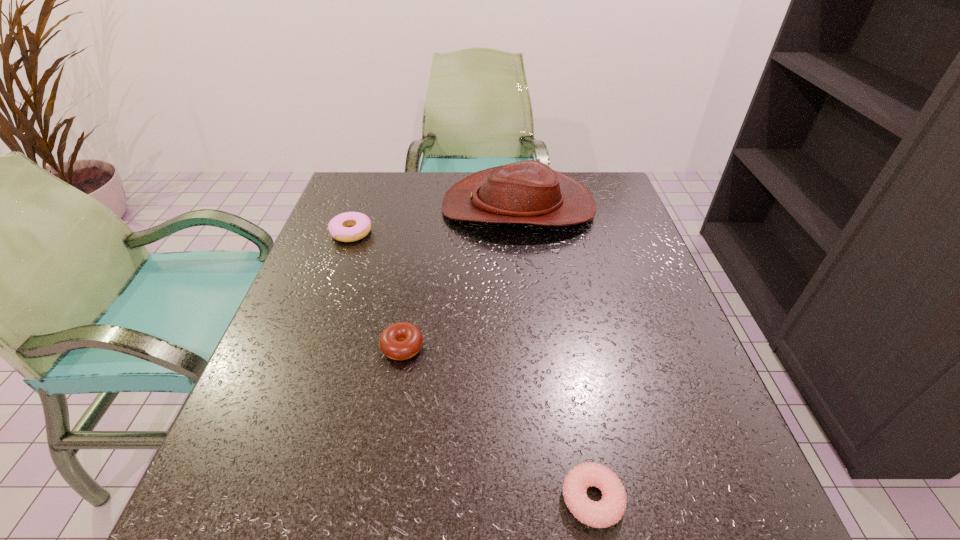
Find the location of a particular element. The height and width of the screenshot is (540, 960). free point between the second nearest doughnut and the leftmost doughnut is located at coordinates click(x=377, y=289).

Where is `vacant area that lies between the tallest object and the second nearest doughnut`? vacant area that lies between the tallest object and the second nearest doughnut is located at coordinates (460, 277).

I want to click on vacant area that lies between the nearest doughnut and the leftmost object, so click(x=472, y=366).

In order to click on free space that is in between the third farthest object and the nearest object in this screenshot , I will do `click(497, 423)`.

Locate an element on the screen. The width and height of the screenshot is (960, 540). free space between the second farthest doughnut and the nearest object is located at coordinates (497, 423).

Locate an element on the screen. The image size is (960, 540). object that is the closest to the nearest object is located at coordinates (402, 340).

Locate an element on the screen. object that is the closest one to the second object from left to right is located at coordinates (339, 227).

Locate which doughnut is the second closest to the rightmost doughnut. Please provide its 2D coordinates. Your answer should be formatted as a tuple, i.e. [(x, y)], where the tuple contains the x and y coordinates of a point satisfying the conditions above.

[(339, 227)]

Where is `the closest doughnut relative to the leftmost doughnut`? The height and width of the screenshot is (540, 960). the closest doughnut relative to the leftmost doughnut is located at coordinates (402, 340).

Image resolution: width=960 pixels, height=540 pixels. Identify the location of vacant space that satisfies the following two spatial constraints: 1. on the back side of the rightmost doughnut; 2. on the front-facing side of the cowboy hat. (540, 207).